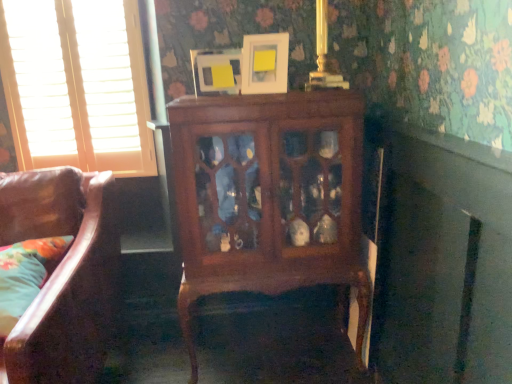
This screenshot has width=512, height=384. What are the coordinates of `white wood blinds at left` in the screenshot? It's located at (77, 85).

I want to click on white matte picture frame at upper center, acting as the 2th picture frame starting from the left, so pos(265,63).

Looking at this image, how much space does white matte picture frame at upper center, which ranks as the 1th picture frame in right-to-left order, occupy vertically?

The height of white matte picture frame at upper center, which ranks as the 1th picture frame in right-to-left order, is 21.22 centimeters.

You are a GUI agent. You are given a task and a screenshot of the screen. Output one action in this format:
    pyautogui.click(x=<x>, y=<y>)
    Task: Click on the fluffy fabric pillow at lower left
    This screenshot has height=384, width=512.
    Given the screenshot: What is the action you would take?
    pyautogui.click(x=26, y=275)

Identify the location of matte white picture frame at upper center, positioned as the 2th picture frame in right-to-left order. (216, 71).

Describe the element at coordinates (268, 196) in the screenshot. I see `mahogany cabinet at center` at that location.

In order to click on white wood blinds at left in this screenshot , I will do `click(77, 85)`.

Based on the photo, is the surface of matte white picture frame at upper center, which appears as the 1th picture frame when viewed from the left, in direct contact with mahogany cabinet at center?

No, matte white picture frame at upper center, which appears as the 1th picture frame when viewed from the left, is not in contact with mahogany cabinet at center.

Considering the relative positions of matte white picture frame at upper center, which appears as the 1th picture frame when viewed from the left, and mahogany cabinet at center in the image provided, is matte white picture frame at upper center, which appears as the 1th picture frame when viewed from the left, behind mahogany cabinet at center?

Yes, matte white picture frame at upper center, which appears as the 1th picture frame when viewed from the left, is further from the camera.

From the image's perspective, between matte white picture frame at upper center, positioned as the 2th picture frame in right-to-left order, and mahogany cabinet at center, who is located below?

mahogany cabinet at center.

Considering the positions of points (60, 248) and (140, 101), is point (60, 248) closer to camera compared to point (140, 101)?

Yes, point (60, 248) is closer to viewer.

Does fluffy fabric pillow at lower left have a lesser width compared to white wood blinds at left?

No.

Between fluffy fabric pillow at lower left and white wood blinds at left, which one appears on the right side from the viewer's perspective?

From the viewer's perspective, fluffy fabric pillow at lower left appears more on the right side.

From a real-world perspective, is fluffy fabric pillow at lower left beneath white wood blinds at left?

Yes.

Which of these two, white wood blinds at left or fluffy fabric pillow at lower left, is thinner?

Thinner between the two is white wood blinds at left.

In the image, there is a white wood blinds at left. Identify the location of pillow below it (from the image's perspective). (26, 275).

Which of these two, mahogany cabinet at center or white wood blinds at left, is wider?

Wider between the two is mahogany cabinet at center.

Does point (276, 286) appear closer or farther from the camera than point (112, 63)?

Point (276, 286) appears to be closer to the viewer than point (112, 63).

Which is correct: mahogany cabinet at center is inside white wood blinds at left, or outside of it?

mahogany cabinet at center cannot be found inside white wood blinds at left.

Which is nearer, (20, 286) or (226, 53)?

The point (20, 286) is more forward.

Based on the photo, can you confirm if fluffy fabric pillow at lower left is bigger than matte white picture frame at upper center, positioned as the 2th picture frame in right-to-left order?

Yes, fluffy fabric pillow at lower left is bigger than matte white picture frame at upper center, positioned as the 2th picture frame in right-to-left order.

From the image's perspective, would you say fluffy fabric pillow at lower left is shown under matte white picture frame at upper center, positioned as the 2th picture frame in right-to-left order?

Yes, from the image's perspective, fluffy fabric pillow at lower left is beneath matte white picture frame at upper center, positioned as the 2th picture frame in right-to-left order.

Is fluffy fabric pillow at lower left positioned with its back to matte white picture frame at upper center, which appears as the 1th picture frame when viewed from the left?

That's not correct — fluffy fabric pillow at lower left is not looking away from matte white picture frame at upper center, which appears as the 1th picture frame when viewed from the left.

Between white wood blinds at left and white matte picture frame at upper center, which ranks as the 1th picture frame in right-to-left order, which one is positioned behind?

white wood blinds at left.

Considering the relative sizes of white wood blinds at left and white matte picture frame at upper center, which ranks as the 1th picture frame in right-to-left order, in the image provided, is white wood blinds at left bigger than white matte picture frame at upper center, which ranks as the 1th picture frame in right-to-left order,?

Correct, white wood blinds at left is larger in size than white matte picture frame at upper center, which ranks as the 1th picture frame in right-to-left order.

Which of these two, white wood blinds at left or white matte picture frame at upper center, which ranks as the 1th picture frame in right-to-left order, is thinner?

white wood blinds at left is thinner.

The image size is (512, 384). What are the coordinates of `window located on the left of white matte picture frame at upper center, which ranks as the 1th picture frame in right-to-left order` in the screenshot? It's located at (77, 85).

Considering the sizes of objects mahogany cabinet at center and matte white picture frame at upper center, positioned as the 2th picture frame in right-to-left order, in the image provided, who is bigger, mahogany cabinet at center or matte white picture frame at upper center, positioned as the 2th picture frame in right-to-left order,?

Bigger between the two is mahogany cabinet at center.

Is mahogany cabinet at center to the left or to the right of matte white picture frame at upper center, which appears as the 1th picture frame when viewed from the left, in the image?

Clearly, mahogany cabinet at center is on the right of matte white picture frame at upper center, which appears as the 1th picture frame when viewed from the left, in the image.

What's the angular difference between mahogany cabinet at center and matte white picture frame at upper center, positioned as the 2th picture frame in right-to-left order,'s facing directions?

The angular difference between mahogany cabinet at center and matte white picture frame at upper center, positioned as the 2th picture frame in right-to-left order, is 11.7 degrees.

From the image's perspective, which one is positioned lower, mahogany cabinet at center or matte white picture frame at upper center, which appears as the 1th picture frame when viewed from the left?

mahogany cabinet at center, from the image's perspective.

Where is `the 2nd picture frame to the left when counting from the mahogany cabinet at center`? the 2nd picture frame to the left when counting from the mahogany cabinet at center is located at coordinates (216, 71).

Find the location of `pillow that appears on the right of white wood blinds at left`. pillow that appears on the right of white wood blinds at left is located at coordinates (26, 275).

Considering their positions, is mahogany cabinet at center positioned further to fluffy fabric pillow at lower left than white matte picture frame at upper center, acting as the 2th picture frame starting from the left?

white matte picture frame at upper center, acting as the 2th picture frame starting from the left.

Looking at the image, which one is located closer to white wood blinds at left, white matte picture frame at upper center, acting as the 2th picture frame starting from the left, or mahogany cabinet at center?

The object closer to white wood blinds at left is mahogany cabinet at center.

Looking at the image, which one is located further to white wood blinds at left, mahogany cabinet at center or white matte picture frame at upper center, acting as the 2th picture frame starting from the left?

Based on the image, white matte picture frame at upper center, acting as the 2th picture frame starting from the left, appears to be further to white wood blinds at left.

Which object lies nearer to the anchor point matte white picture frame at upper center, positioned as the 2th picture frame in right-to-left order, mahogany cabinet at center or white wood blinds at left?

The object closer to matte white picture frame at upper center, positioned as the 2th picture frame in right-to-left order, is mahogany cabinet at center.

Based on the photo, estimate the real-world distances between objects in this image. Which object is further from white wood blinds at left, matte white picture frame at upper center, which appears as the 1th picture frame when viewed from the left, or fluffy fabric pillow at lower left?

fluffy fabric pillow at lower left is further to white wood blinds at left.

Looking at the image, which one is located further to matte white picture frame at upper center, which appears as the 1th picture frame when viewed from the left, mahogany cabinet at center or white matte picture frame at upper center, which ranks as the 1th picture frame in right-to-left order?

mahogany cabinet at center is further to matte white picture frame at upper center, which appears as the 1th picture frame when viewed from the left.

Which object lies further to the anchor point white wood blinds at left, matte white picture frame at upper center, which appears as the 1th picture frame when viewed from the left, or white matte picture frame at upper center, which ranks as the 1th picture frame in right-to-left order?

Among the two, white matte picture frame at upper center, which ranks as the 1th picture frame in right-to-left order, is located further to white wood blinds at left.

When comparing their distances from fluffy fabric pillow at lower left, does mahogany cabinet at center or white wood blinds at left seem further?

white wood blinds at left.

Identify the location of pillow between white wood blinds at left and mahogany cabinet at center. (26, 275).

Identify the location of picture frame between fluffy fabric pillow at lower left and white matte picture frame at upper center, acting as the 2th picture frame starting from the left. The height and width of the screenshot is (384, 512). (216, 71).

This screenshot has width=512, height=384. I want to click on picture frame located between white wood blinds at left and white matte picture frame at upper center, which ranks as the 1th picture frame in right-to-left order, in the left-right direction, so click(x=216, y=71).

Locate an element on the screen. Image resolution: width=512 pixels, height=384 pixels. picture frame between white matte picture frame at upper center, acting as the 2th picture frame starting from the left, and mahogany cabinet at center in the up-down direction is located at coordinates (216, 71).